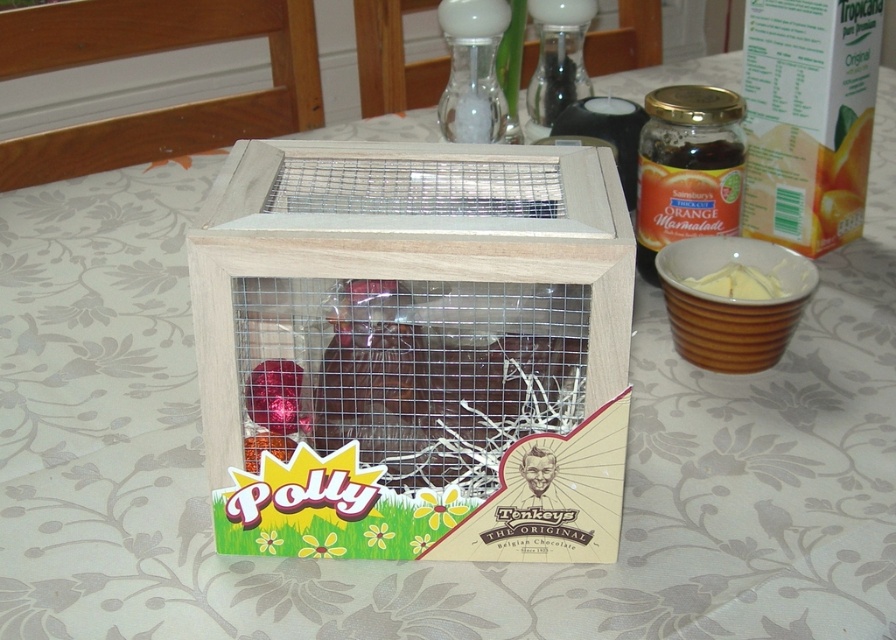
You are a chef preparing a dessert and need to place both the wooden wire mesh bird cage at center and the yellow creamy butter at center on a small round plate. The plate has a diameter of 20 cm. Can both items fit on the plate without overlapping?

The wooden wire mesh bird cage at center is bigger than yellow creamy butter at center. However, since the exact sizes are not provided, it is uncertain if both can fit on the 20 cm plate without overlapping.

You are a chef preparing a dessert and see the shiny chocolate bar at center and the yellow creamy butter at center on the table. Which ingredient is located to the left of the other?

The shiny chocolate bar at center is positioned on the left side of yellow creamy butter at center.

You are a photographer trying to take a closeup shot of the wooden wire mesh bird cage at center. You have a camera that can focus as close as 50 centimeters. Can you get a clear closeup without moving the camera closer?

The wooden wire mesh bird cage at center is 62.09 centimeters away from the camera. Since your camera can focus as close as 50 centimeters, you need to move the camera closer to get a clear closeup.